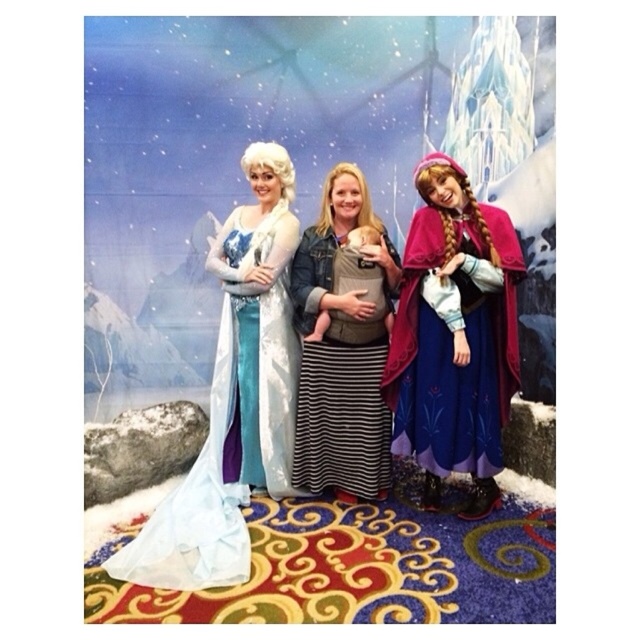
Between point (460, 470) and point (356, 268), which one is positioned in front?

Positioned in front is point (460, 470).

What do you see at coordinates (454, 337) in the screenshot? The width and height of the screenshot is (640, 640). I see `velvet purple cape at right` at bounding box center [454, 337].

Find the location of a particular element. velvet purple cape at right is located at coordinates (454, 337).

Can you confirm if satin blue gown at left is positioned to the left of satin blue gown at center?

Correct, you'll find satin blue gown at left to the left of satin blue gown at center.

Is satin blue gown at left above satin blue gown at center?

Actually, satin blue gown at left is below satin blue gown at center.

Where is `satin blue gown at left`? Image resolution: width=640 pixels, height=640 pixels. satin blue gown at left is located at coordinates (234, 397).

Which is more to the left, velvet purple cape at right or satin blue gown at center?

Positioned to the left is satin blue gown at center.

In the scene shown: Which is more to the right, velvet purple cape at right or satin blue gown at center?

velvet purple cape at right is more to the right.

Locate an element on the screen. velvet purple cape at right is located at coordinates (454, 337).